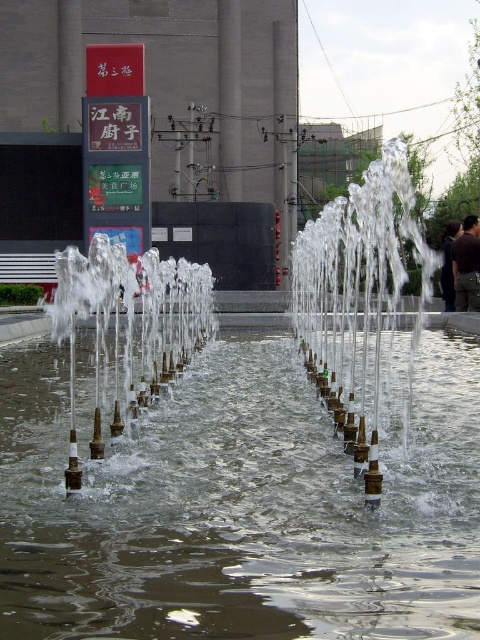
Is clear water at center thinner than clear water jets at center?

Yes, clear water at center is thinner than clear water jets at center.

Does clear water at center appear on the right side of clear water jets at center?

In fact, clear water at center is to the left of clear water jets at center.

Which is behind, point (206, 520) or point (362, 438)?

Point (362, 438)

Locate an element on the screen. clear water at center is located at coordinates (240, 508).